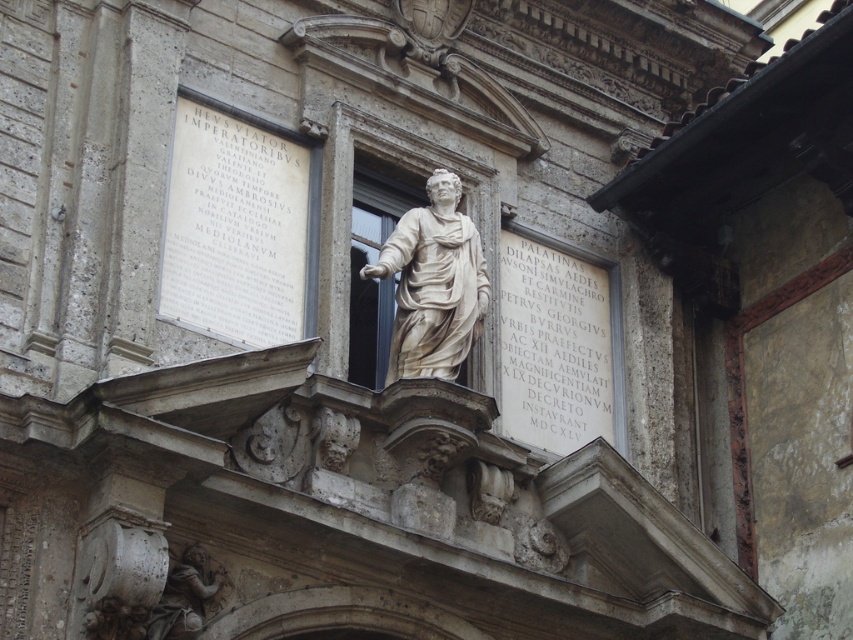
You are an architect examining the historical building. You notice the white stone plaque at upper left and the light beige marble statue at center. Which object is shorter in height?

The white stone plaque at upper left has a lesser height compared to the light beige marble statue at center, so the white stone plaque at upper left is shorter.

You are an art conservator examining the historical building. You need to determine the spatial relationship between the white stone plaque at upper left and the white marble cherub at lower left. Based on the scene, which object is positioned higher up?

The white stone plaque at upper left is positioned higher up than the white marble cherub at lower left.

You are an architect examining this historical building and need to determine the relative sizes of the white stone plaque at upper left and the white marble cherub at lower left. Which object is taller?

The white marble cherub at lower left is taller than the white stone plaque at upper left.